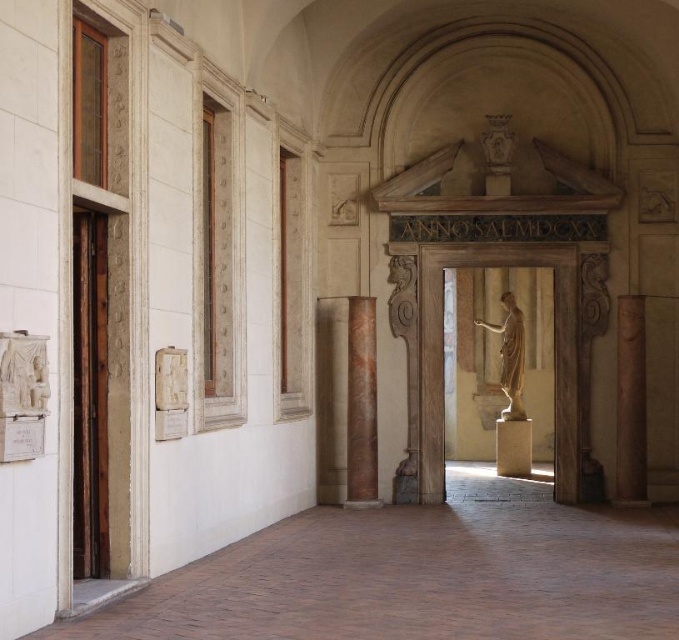
Question: Can you confirm if marble column at center is positioned to the right of white marble statue at left?

Choices:
 (A) yes
 (B) no

Answer: (A)

Question: Which of the following is the closest to the observer?

Choices:
 (A) matte gold statue at center
 (B) white marble statue at left
 (C) brown polished stone column at right

Answer: (B)

Question: Based on their relative distances, which object is farther from the marble column at center?

Choices:
 (A) matte gold statue at center
 (B) brown polished stone column at right
 (C) white marble statue at left

Answer: (C)

Question: From the image, what is the correct spatial relationship of marble column at center in relation to matte gold statue at center?

Choices:
 (A) left
 (B) right

Answer: (A)

Question: Is marble column at center further to the viewer compared to white marble statue at left?

Choices:
 (A) no
 (B) yes

Answer: (B)

Question: Estimate the real-world distances between objects in this image. Which object is closer to the matte gold statue at center?

Choices:
 (A) marble column at center
 (B) brown polished stone column at right

Answer: (B)